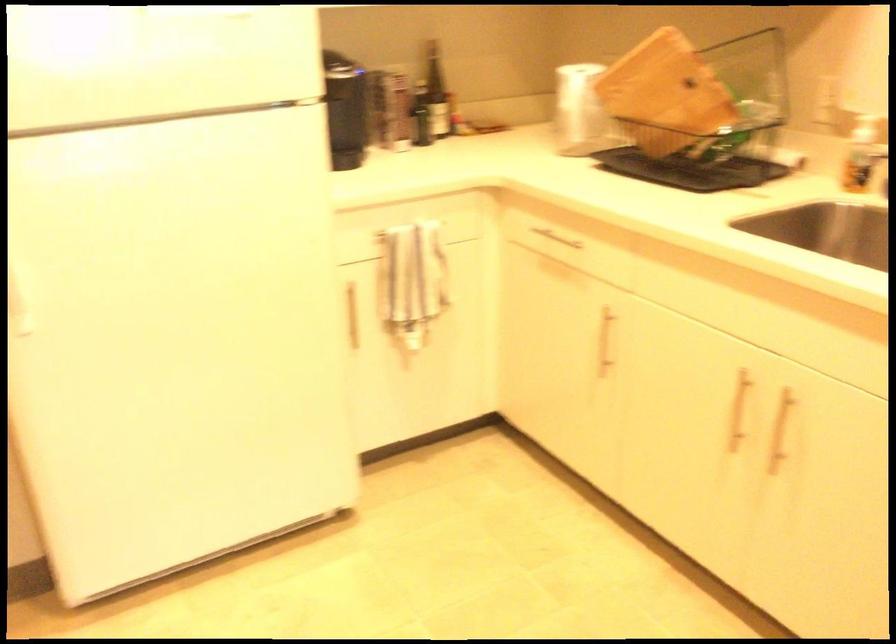
Image resolution: width=896 pixels, height=644 pixels. In order to click on dark glass bottle in this screenshot , I will do `click(435, 91)`.